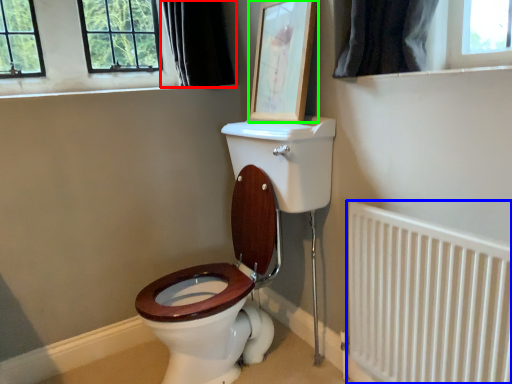
Question: Considering the real-world distances, which object is farthest from curtain (highlighted by a red box)? radiator (highlighted by a blue box) or picture frame (highlighted by a green box)?

Choices:
 (A) radiator
 (B) picture frame

Answer: (A)